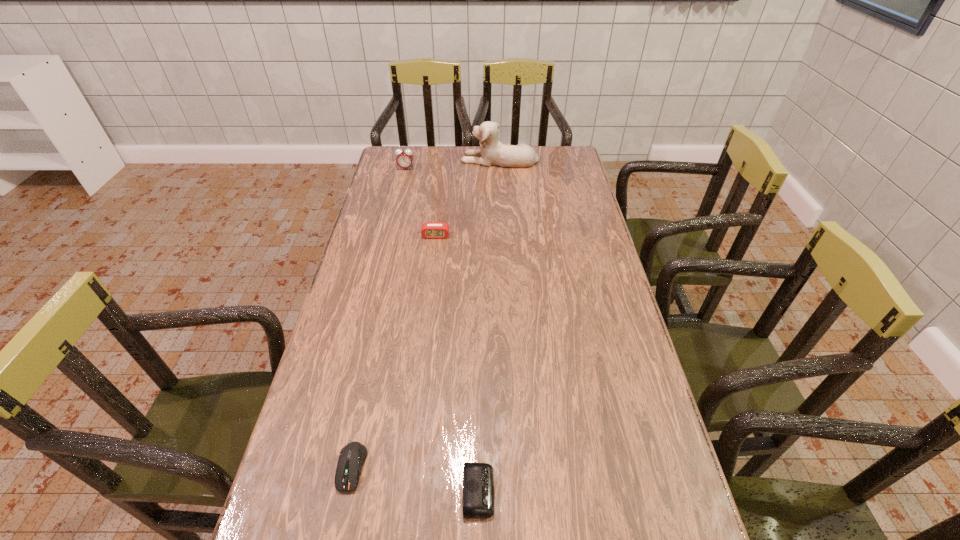
I want to click on puppy, so click(493, 152).

You are a GUI agent. You are given a task and a screenshot of the screen. Output one action in this format:
    pyautogui.click(x=<x>, y=<y>)
    Task: Click on the leftmost alarm clock
    The width and height of the screenshot is (960, 540).
    Given the screenshot: What is the action you would take?
    pyautogui.click(x=404, y=159)

This screenshot has width=960, height=540. I want to click on the farthest alarm clock, so pyautogui.click(x=404, y=159).

The height and width of the screenshot is (540, 960). I want to click on the third shortest object, so click(x=430, y=230).

This screenshot has width=960, height=540. In order to click on the second tallest alarm clock in this screenshot , I will do `click(430, 230)`.

Find the location of a particular element. This screenshot has width=960, height=540. the second shortest object is located at coordinates (352, 456).

This screenshot has height=540, width=960. What are the coordinates of `the shortest object` in the screenshot? It's located at (478, 478).

I want to click on the nearest alarm clock, so click(478, 478).

Locate an element on the screen. vacant space located 0.080m on the front-facing side of the puppy is located at coordinates (442, 159).

The width and height of the screenshot is (960, 540). I want to click on free location located on the front-facing side of the puppy, so click(x=432, y=159).